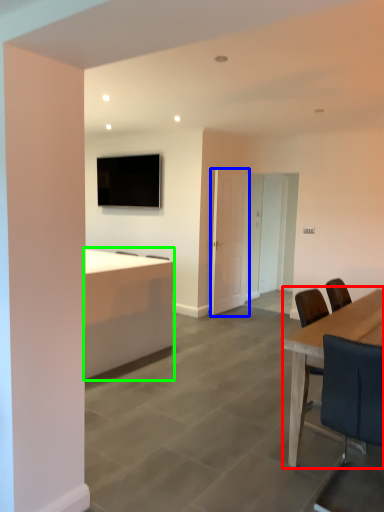
Question: Which object is the closest to the table (highlighted by a red box)? Choose among these: door (highlighted by a blue box) or desk (highlighted by a green box).

Choices:
 (A) door
 (B) desk

Answer: (B)